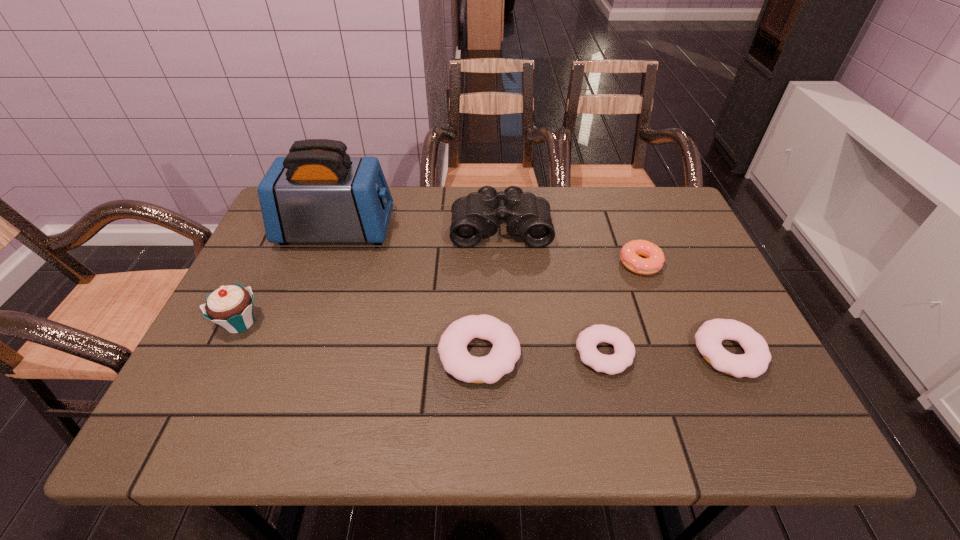
The image size is (960, 540). I want to click on free space between the binoculars and the shortest object, so click(552, 291).

Identify the location of vacant space that's between the tallest object and the cupcake. (288, 276).

Locate an element on the screen. This screenshot has width=960, height=540. vacant region between the binoculars and the farthest doughnut is located at coordinates (570, 245).

I want to click on free space between the second shortest doughnut and the shortest object, so click(666, 353).

What are the coordinates of `empty space between the shortest doughnut and the cupcake` in the screenshot? It's located at (422, 338).

At what (x,y) coordinates should I click in order to perform the action: click on empty space between the second shortest object and the binoculars. Please return your answer as a coordinate pair (x, y). Image resolution: width=960 pixels, height=540 pixels. Looking at the image, I should click on (614, 290).

Choose which object is the fifth nearest neighbor to the cupcake. Please provide its 2D coordinates. Your answer should be formatted as a tuple, i.e. [(x, y)], where the tuple contains the x and y coordinates of a point satisfying the conditions above.

[(654, 258)]

Select which object is the fifth closest to the cupcake. Please provide its 2D coordinates. Your answer should be formatted as a tuple, i.e. [(x, y)], where the tuple contains the x and y coordinates of a point satisfying the conditions above.

[(654, 258)]

At what (x,y) coordinates should I click in order to perform the action: click on the second closest doughnut to the shortest doughnut. Please return your answer as a coordinate pair (x, y). The image size is (960, 540). Looking at the image, I should click on (754, 362).

Locate which doughnut is the third closest to the toaster. Please provide its 2D coordinates. Your answer should be formatted as a tuple, i.e. [(x, y)], where the tuple contains the x and y coordinates of a point satisfying the conditions above.

[(654, 258)]